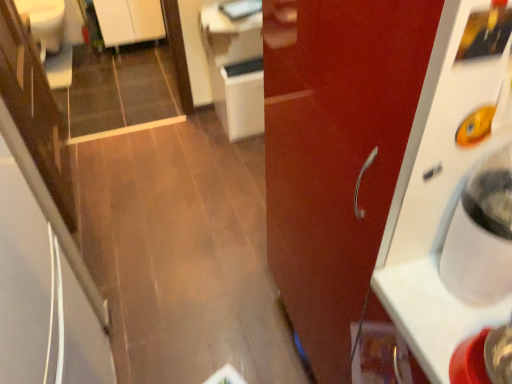
Question: Is white glossy cabinet at upper left, which is the second cabinetry from front to back, in front of or behind white glossy cabinet at center, arranged as the second cabinetry when viewed from the back, in the image?

Choices:
 (A) behind
 (B) front

Answer: (A)

Question: In terms of height, does white glossy cabinet at upper left, which is the 2th cabinetry from right to left, look taller or shorter compared to white glossy cabinet at center, arranged as the second cabinetry when viewed from the back?

Choices:
 (A) short
 (B) tall

Answer: (A)

Question: Which object is the closest to the white glossy cabinet at center, the 1th cabinetry in the bottom-to-top sequence?

Choices:
 (A) white glossy cabinet at upper left, which is the first cabinetry in top-to-bottom order
 (B) white plastic water cooler at right
 (C) glossy wood door at right
 (D) white glossy counter top at upper center

Answer: (D)

Question: Which is nearer to the white plastic water cooler at right?

Choices:
 (A) white glossy counter top at upper center
 (B) white glossy cabinet at center, positioned as the first cabinetry in front-to-back order
 (C) white glossy cabinet at upper left, which is the first cabinetry in top-to-bottom order
 (D) glossy wood door at right

Answer: (D)